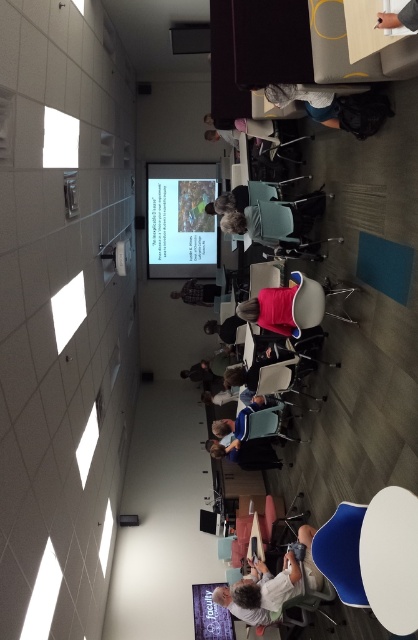
Question: Can you confirm if matte plastic projector screen at upper center is thinner than denim shorts at center?

Choices:
 (A) no
 (B) yes

Answer: (A)

Question: Which object is farther from the camera taking this photo?

Choices:
 (A) blue fabric chair at lower right
 (B) pink fabric at center
 (C) matte black backpack at center

Answer: (C)

Question: Is matte plastic projector screen at upper center above pink fabric at center?

Choices:
 (A) yes
 (B) no

Answer: (A)

Question: Estimate the real-world distances between objects in this image. Which object is closer to the denim shorts at center?

Choices:
 (A) matte black backpack at center
 (B) pink fabric at center
 (C) dark gray fabric jacket at center
 (D) matte plastic projector screen at upper center

Answer: (B)

Question: Can you confirm if matte plastic projector screen at upper center is wider than dark gray fabric jacket at center?

Choices:
 (A) yes
 (B) no

Answer: (A)

Question: Which of these objects is positioned closest to the denim shorts at center?

Choices:
 (A) white fabric shirt at lower center
 (B) dark gray fabric jacket at center

Answer: (B)